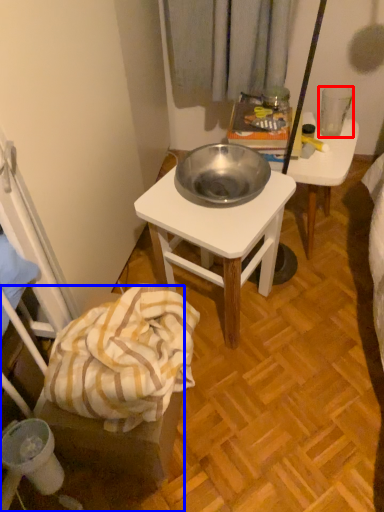
Question: Which object appears closest to the camera in this image, coffee cup (highlighted by a red box) or chair (highlighted by a blue box)?

Choices:
 (A) coffee cup
 (B) chair

Answer: (B)